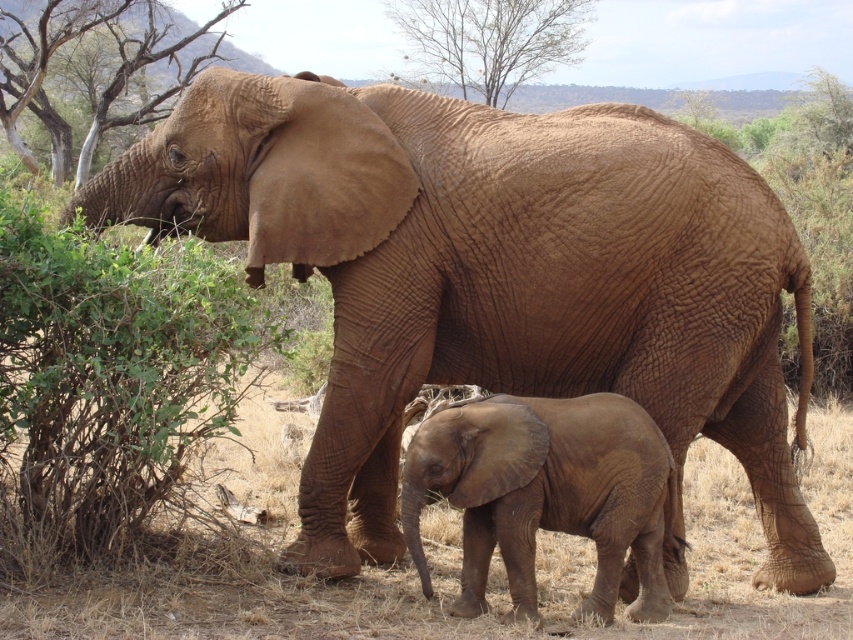
Where is `matte brown elephant at lower center`? The height and width of the screenshot is (640, 853). matte brown elephant at lower center is located at coordinates (544, 493).

Where is `matte brown elephant at lower center`? Image resolution: width=853 pixels, height=640 pixels. matte brown elephant at lower center is located at coordinates (544, 493).

Between brown bark tree at left and bare wood tree at upper center, which one is positioned lower?

Positioned lower is brown bark tree at left.

Is brown bark tree at left to the left of bare wood tree at upper center from the viewer's perspective?

Indeed, brown bark tree at left is positioned on the left side of bare wood tree at upper center.

Where is `brown bark tree at left`? This screenshot has width=853, height=640. brown bark tree at left is located at coordinates (106, 76).

Does point (53, 474) come farther from viewer compared to point (13, 129)?

No, it is not.

Is point (161, 360) more distant than point (15, 64)?

That is False.

Where is `green leafy bush at upper left`? green leafy bush at upper left is located at coordinates (109, 378).